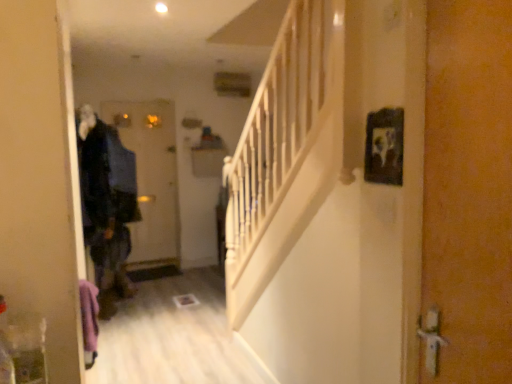
This screenshot has width=512, height=384. What are the coordinates of `dark blue fabric coat at left` in the screenshot? It's located at (106, 197).

In order to face matte black door at center, the second door when ordered from right to left, should I rotate leftwards or rightwards?

Rotate left and turn 14.866 degrees.

Measure the distance between point (x=168, y=191) and camera.

Point (x=168, y=191) is 20.00 feet from camera.

Image resolution: width=512 pixels, height=384 pixels. What are the coordinates of `dark blue fabric coat at left` in the screenshot? It's located at 106,197.

Based on the photo, are black matte picture frame at upper right and dark blue fabric coat at left far apart?

Indeed, black matte picture frame at upper right is not near dark blue fabric coat at left.

Which is farther, (372, 133) or (110, 133)?

The point (110, 133) is farther.

Find the location of a particular element. The image size is (512, 384). picture frame above the dark blue fabric coat at left (from a real-world perspective) is located at coordinates (384, 146).

Measure the distance between black matte picture frame at upper right and dark blue fabric coat at left.

black matte picture frame at upper right is 7.76 feet away from dark blue fabric coat at left.

Does orange textured door at right, which is the first door from right to left, appear on the right side of matte black door at center, which is the first door in left-to-right order?

Correct, you'll find orange textured door at right, which is the first door from right to left, to the right of matte black door at center, which is the first door in left-to-right order.

Which object is more forward, orange textured door at right, which is the 2th door from back to front, or matte black door at center, the second door when ordered from right to left?

Positioned in front is orange textured door at right, which is the 2th door from back to front.

Considering the relative sizes of orange textured door at right, which is the first door from right to left, and matte black door at center, which is the first door in left-to-right order, in the image provided, is orange textured door at right, which is the first door from right to left, smaller than matte black door at center, which is the first door in left-to-right order,?

Correct, orange textured door at right, which is the first door from right to left, occupies less space than matte black door at center, which is the first door in left-to-right order.

Where is `door to the right of matte black door at center, the second door when ordered from right to left`? The height and width of the screenshot is (384, 512). door to the right of matte black door at center, the second door when ordered from right to left is located at coordinates (468, 189).

Could you tell me if black matte picture frame at upper right is turned towards orange textured door at right, arranged as the first door when viewed from the front?

No, black matte picture frame at upper right is not turned towards orange textured door at right, arranged as the first door when viewed from the front.

Can you tell me how much black matte picture frame at upper right and orange textured door at right, arranged as the first door when viewed from the front, differ in facing direction?

They differ by 0.00291 degrees in their facing directions.

Which of these two, black matte picture frame at upper right or orange textured door at right, which is the first door from right to left, stands shorter?

black matte picture frame at upper right is shorter.

Which of these two, black matte picture frame at upper right or orange textured door at right, marked as the 2th door in a left-to-right arrangement, is bigger?

orange textured door at right, marked as the 2th door in a left-to-right arrangement, is bigger.

Which object is more forward, orange textured door at right, which is the first door from right to left, or dark blue fabric coat at left?

orange textured door at right, which is the first door from right to left, is closer to the camera.

Would you consider orange textured door at right, which is the 2th door from back to front, to be distant from dark blue fabric coat at left?

orange textured door at right, which is the 2th door from back to front, is far away from dark blue fabric coat at left.

In terms of height, does orange textured door at right, arranged as the first door when viewed from the front, look taller or shorter compared to dark blue fabric coat at left?

orange textured door at right, arranged as the first door when viewed from the front, is taller than dark blue fabric coat at left.

Consider the image. Would you say orange textured door at right, which is the first door from right to left, contains dark blue fabric coat at left?

Definitely not — dark blue fabric coat at left is not inside orange textured door at right, which is the first door from right to left.

From a real-world perspective, who is located lower, matte black door at center, which is the first door in left-to-right order, or orange textured door at right, which is the first door from right to left?

matte black door at center, which is the first door in left-to-right order.

From the image's perspective, which one is positioned lower, matte black door at center, placed as the 1th door when sorted from back to front, or orange textured door at right, marked as the 2th door in a left-to-right arrangement?

orange textured door at right, marked as the 2th door in a left-to-right arrangement, from the image's perspective.

Identify the location of door above the orange textured door at right, marked as the 2th door in a left-to-right arrangement (from the image's perspective). This screenshot has width=512, height=384. (151, 177).

Looking at this image, considering the sizes of objects matte black door at center, placed as the 1th door when sorted from back to front, and orange textured door at right, which is the first door from right to left, in the image provided, who is bigger, matte black door at center, placed as the 1th door when sorted from back to front, or orange textured door at right, which is the first door from right to left,?

With larger size is matte black door at center, placed as the 1th door when sorted from back to front.

Which is behind, matte black door at center, placed as the 1th door when sorted from back to front, or black matte picture frame at upper right?

matte black door at center, placed as the 1th door when sorted from back to front, is behind.

Is matte black door at center, the second door when ordered from right to left, thinner than black matte picture frame at upper right?

No, matte black door at center, the second door when ordered from right to left, is not thinner than black matte picture frame at upper right.

Locate an element on the screen. The image size is (512, 384). door behind the black matte picture frame at upper right is located at coordinates (151, 177).

From the image's perspective, is matte black door at center, the second door when ordered from right to left, on top of black matte picture frame at upper right?

No, from the image's perspective, matte black door at center, the second door when ordered from right to left, is not over black matte picture frame at upper right.

Is dark blue fabric coat at left positioned behind matte black door at center, the second door when ordered from right to left?

No, the depth of dark blue fabric coat at left is less than that of matte black door at center, the second door when ordered from right to left.

Is point (112, 262) closer or farther from the camera than point (175, 257)?

Point (112, 262).

How different are the orientations of dark blue fabric coat at left and matte black door at center, the second door viewed from the front, in degrees?

The angular difference between dark blue fabric coat at left and matte black door at center, the second door viewed from the front, is 89.9 degrees.

Could you tell me if dark blue fabric coat at left is facing matte black door at center, which is the first door in left-to-right order?

No, dark blue fabric coat at left is not oriented towards matte black door at center, which is the first door in left-to-right order.

Identify the location of clothing that is above the black matte picture frame at upper right (from the image's perspective). Image resolution: width=512 pixels, height=384 pixels. point(106,197).

At what (x,y) coordinates should I click in order to perform the action: click on door below the orange textured door at right, which is the 2th door from back to front (from a real-world perspective). Please return your answer as a coordinate pair (x, y). Looking at the image, I should click on (151, 177).

Considering their positions, is orange textured door at right, which is the first door from right to left, positioned further to dark blue fabric coat at left than matte black door at center, the second door when ordered from right to left?

The object further to dark blue fabric coat at left is orange textured door at right, which is the first door from right to left.

Estimate the real-world distances between objects in this image. Which object is closer to matte black door at center, placed as the 1th door when sorted from back to front, dark blue fabric coat at left or black matte picture frame at upper right?

dark blue fabric coat at left lies closer to matte black door at center, placed as the 1th door when sorted from back to front, than the other object.

Looking at the image, which one is located further to orange textured door at right, which is the first door from right to left, matte black door at center, placed as the 1th door when sorted from back to front, or dark blue fabric coat at left?

The object further to orange textured door at right, which is the first door from right to left, is matte black door at center, placed as the 1th door when sorted from back to front.

Which object lies further to the anchor point orange textured door at right, which is the first door from right to left, black matte picture frame at upper right or matte black door at center, the second door when ordered from right to left?

matte black door at center, the second door when ordered from right to left.

Considering their positions, is orange textured door at right, which is the 2th door from back to front, positioned further to black matte picture frame at upper right than dark blue fabric coat at left?

Among the two, dark blue fabric coat at left is located further to black matte picture frame at upper right.

Based on their spatial positions, is matte black door at center, the second door viewed from the front, or orange textured door at right, marked as the 2th door in a left-to-right arrangement, closer to black matte picture frame at upper right?

The object closer to black matte picture frame at upper right is orange textured door at right, marked as the 2th door in a left-to-right arrangement.

Estimate the real-world distances between objects in this image. Which object is closer to dark blue fabric coat at left, orange textured door at right, which is the 2th door from back to front, or black matte picture frame at upper right?

black matte picture frame at upper right is positioned closer to the anchor dark blue fabric coat at left.

Considering their positions, is orange textured door at right, marked as the 2th door in a left-to-right arrangement, positioned closer to matte black door at center, placed as the 1th door when sorted from back to front, than dark blue fabric coat at left?

dark blue fabric coat at left.

Locate an element on the screen. This screenshot has width=512, height=384. clothing between black matte picture frame at upper right and matte black door at center, the second door when ordered from right to left, along the z-axis is located at coordinates coord(106,197).

Locate an element on the screen. clothing between orange textured door at right, which is the first door from right to left, and matte black door at center, placed as the 1th door when sorted from back to front, along the z-axis is located at coordinates (106, 197).

This screenshot has height=384, width=512. I want to click on picture frame positioned between orange textured door at right, marked as the 2th door in a left-to-right arrangement, and dark blue fabric coat at left from near to far, so click(384, 146).

Identify the location of picture frame positioned between orange textured door at right, which is the first door from right to left, and matte black door at center, the second door viewed from the front, from near to far. The width and height of the screenshot is (512, 384). (384, 146).